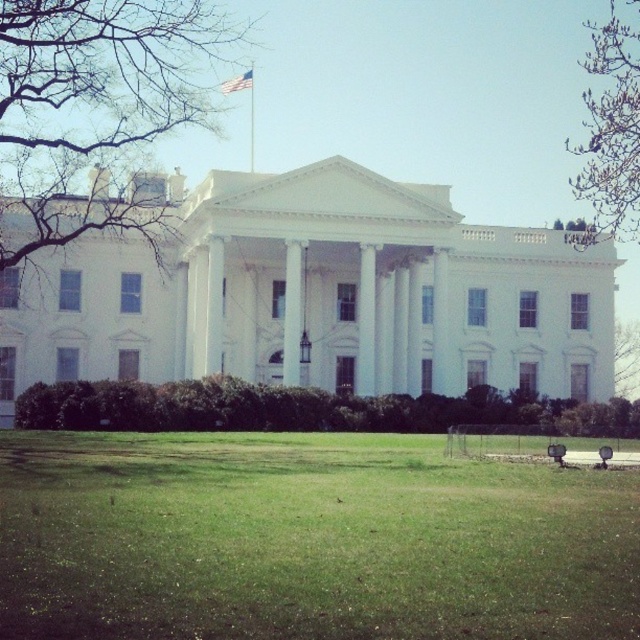
Question: Estimate the real-world distances between objects in this image. Which object is closer to the green grass at center?

Choices:
 (A) white fabric flag at upper center
 (B) metallic flag pole at upper center

Answer: (A)

Question: Is green grass at center thinner than metallic flag pole at upper center?

Choices:
 (A) yes
 (B) no

Answer: (B)

Question: Is metallic flag pole at upper center to the left of white fabric flag at upper center from the viewer's perspective?

Choices:
 (A) no
 (B) yes

Answer: (A)

Question: Among these objects, which one is nearest to the camera?

Choices:
 (A) metallic flag pole at upper center
 (B) green grass at center
 (C) white fabric flag at upper center

Answer: (B)

Question: Can you confirm if metallic flag pole at upper center is positioned to the left of white fabric flag at upper center?

Choices:
 (A) yes
 (B) no

Answer: (B)

Question: Which object is farther from the camera taking this photo?

Choices:
 (A) metallic flag pole at upper center
 (B) white fabric flag at upper center

Answer: (A)